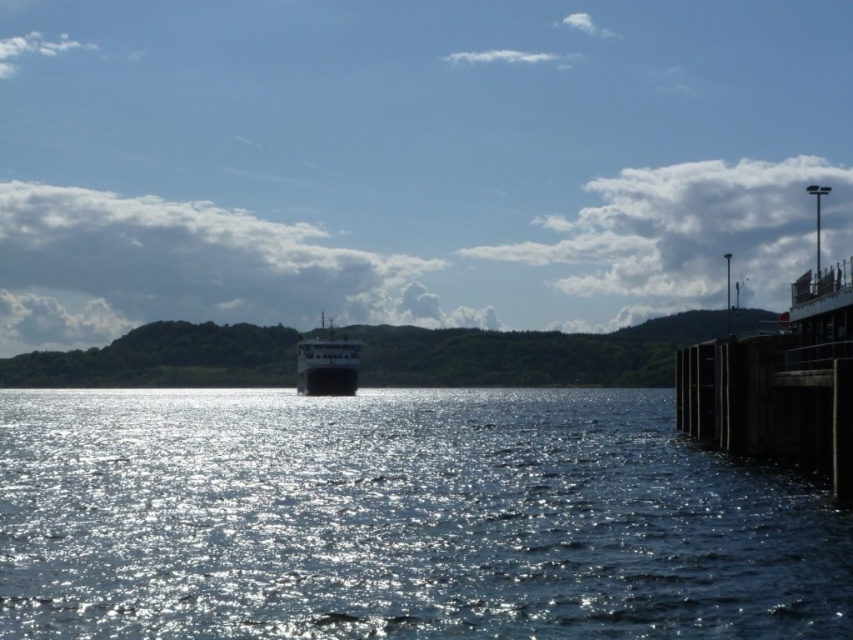
Question: Does shiny reflective water at center lie in front of shiny black ship at center?

Choices:
 (A) yes
 (B) no

Answer: (A)

Question: Is shiny reflective water at center further to the viewer compared to shiny black ship at center?

Choices:
 (A) yes
 (B) no

Answer: (B)

Question: Is shiny reflective water at center smaller than shiny black ship at center?

Choices:
 (A) yes
 (B) no

Answer: (B)

Question: Which of the following is the farthest from the observer?

Choices:
 (A) (368, 401)
 (B) (328, 348)

Answer: (B)